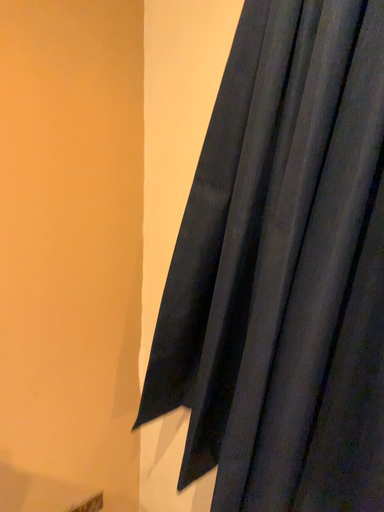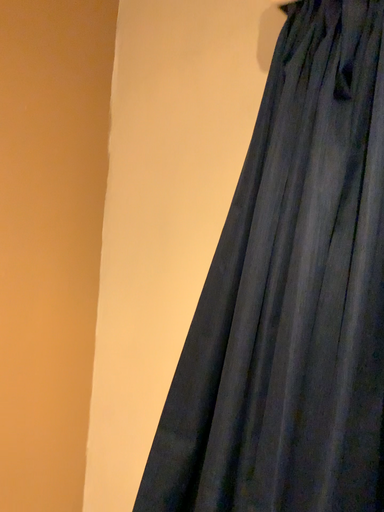
Question: How did the camera likely rotate when shooting the video?

Choices:
 (A) rotated upward
 (B) rotated downward

Answer: (A)